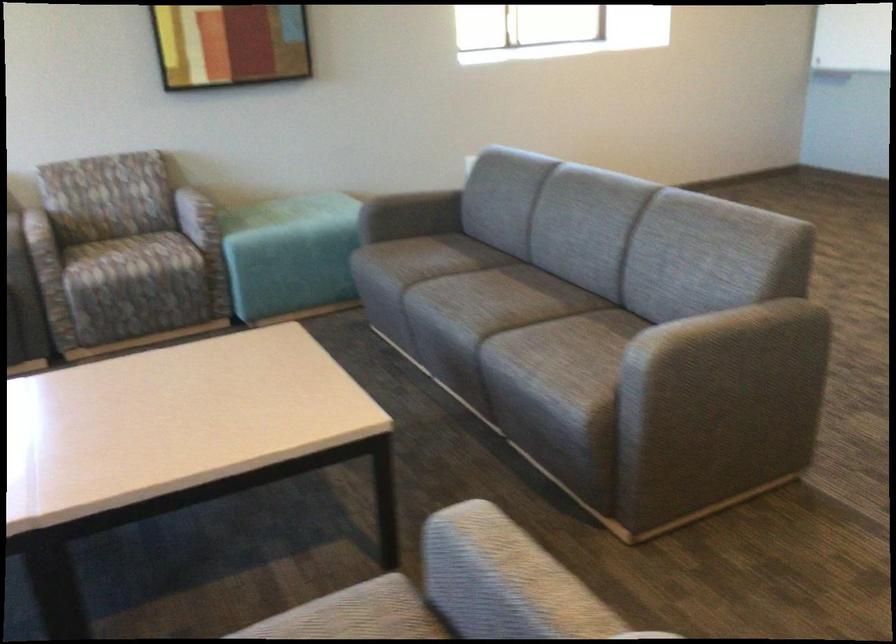
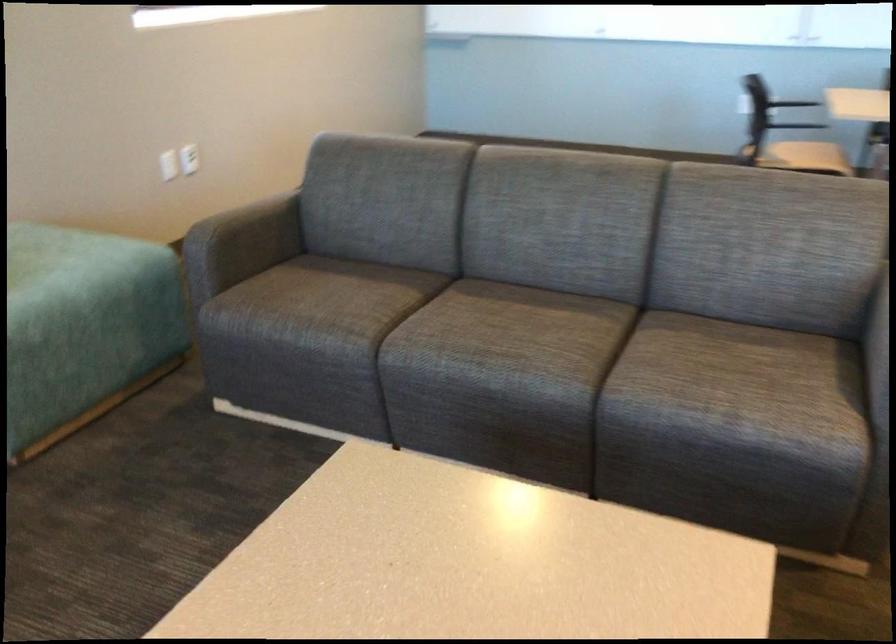
In the second image, find the point that corresponds to point 467,158 in the first image.

(168, 165)